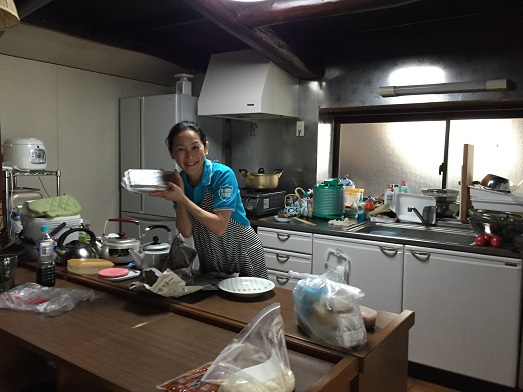
Find the location of `sink`. sink is located at coordinates (457, 235).